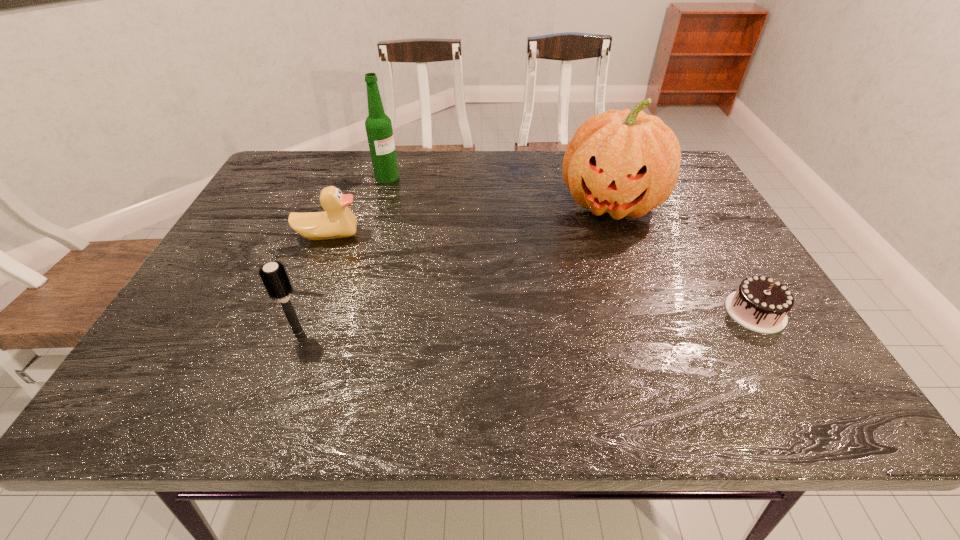
Identify the location of vacant space on the desktop that is between the third tallest object and the shortest object and is positioned on the carved face of the fourth object from left to right. This screenshot has width=960, height=540. (575, 319).

Find the location of `vacant space on the desktop that is between the third shortest object and the shortest object and is positioned at the beak of the duck`. vacant space on the desktop that is between the third shortest object and the shortest object and is positioned at the beak of the duck is located at coordinates (480, 323).

This screenshot has width=960, height=540. I want to click on vacant spot on the desktop that is between the hairbrush and the shortest object and is positioned on the label of the beer bottle, so click(585, 319).